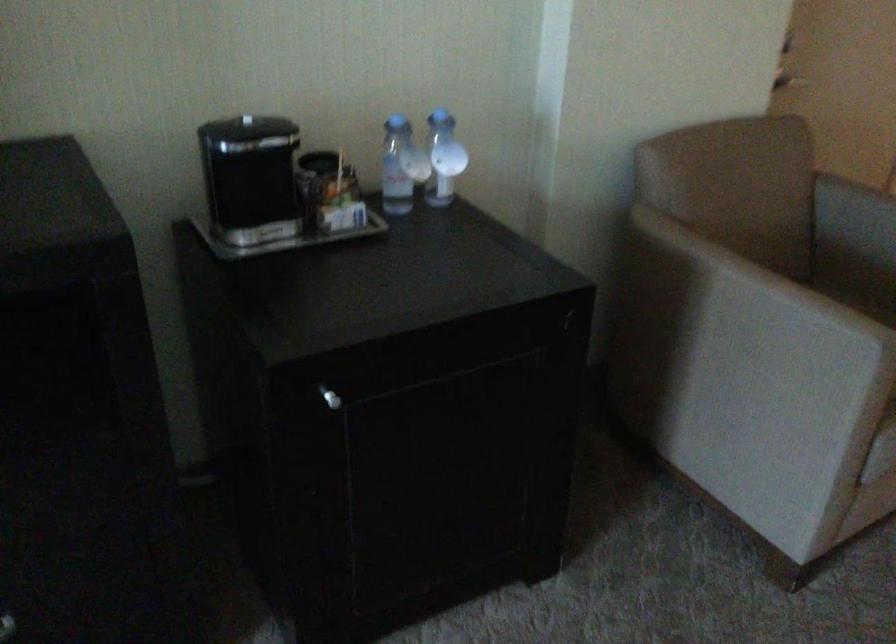
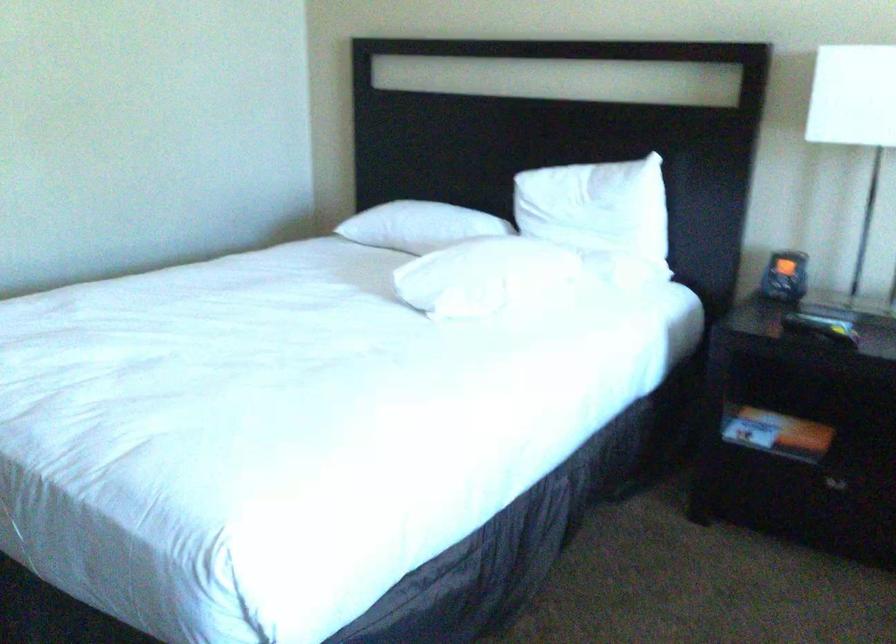
In the scene shown: The images are taken continuously from a first-person perspective. In which direction is your viewpoint rotating?

The rotation direction of the camera is right-down.